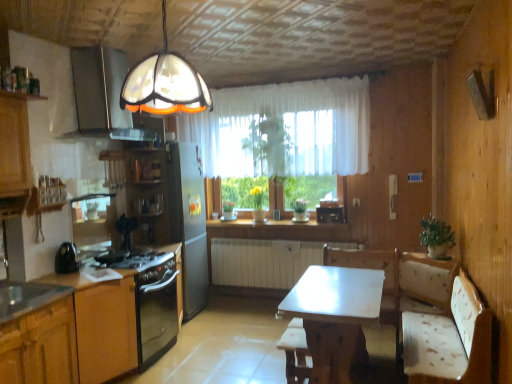
At what (x,y) coordinates should I click in order to perform the action: click on empty space that is to the right of black glossy kettle at left. Please return your answer as a coordinate pair (x, y). This screenshot has height=384, width=512. Looking at the image, I should click on (95, 271).